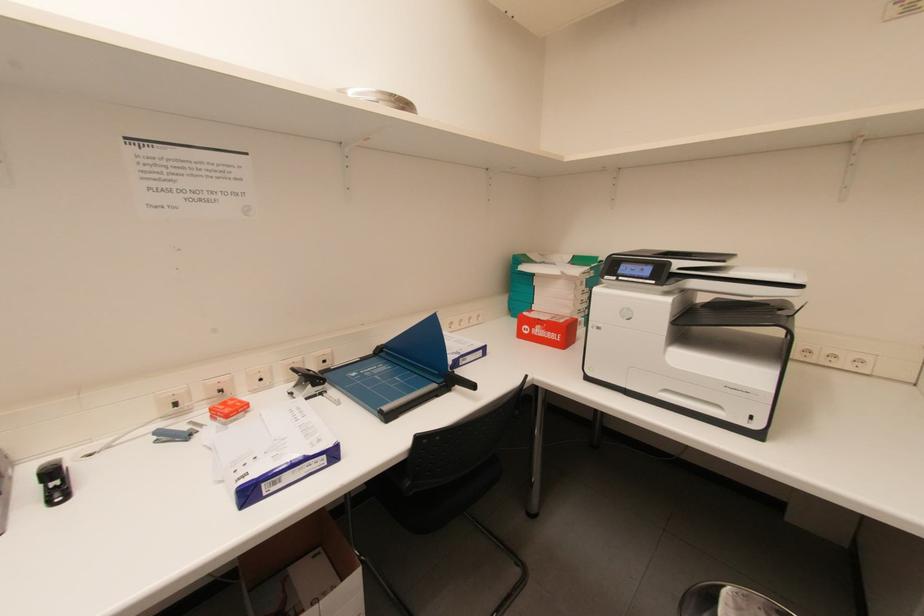
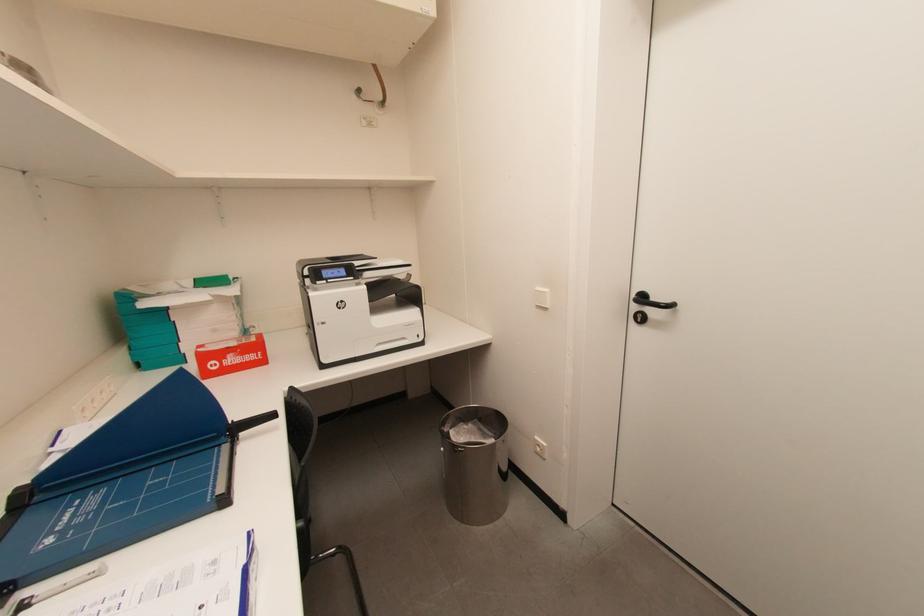
Question: The images are taken continuously from a first-person perspective. In which direction is your viewpoint rotating?

Choices:
 (A) Left
 (B) Right
 (C) Up
 (D) Down

Answer: (B)